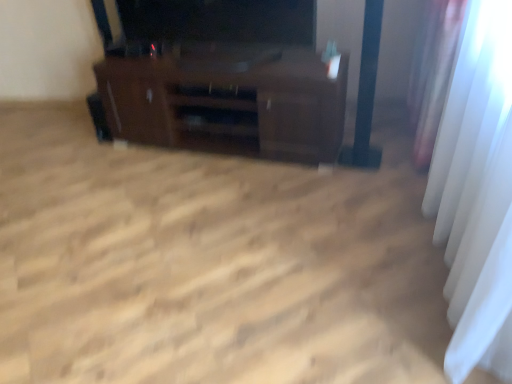
The image size is (512, 384). Identify the location of vacant region to the left of white sheer curtain at right. (240, 233).